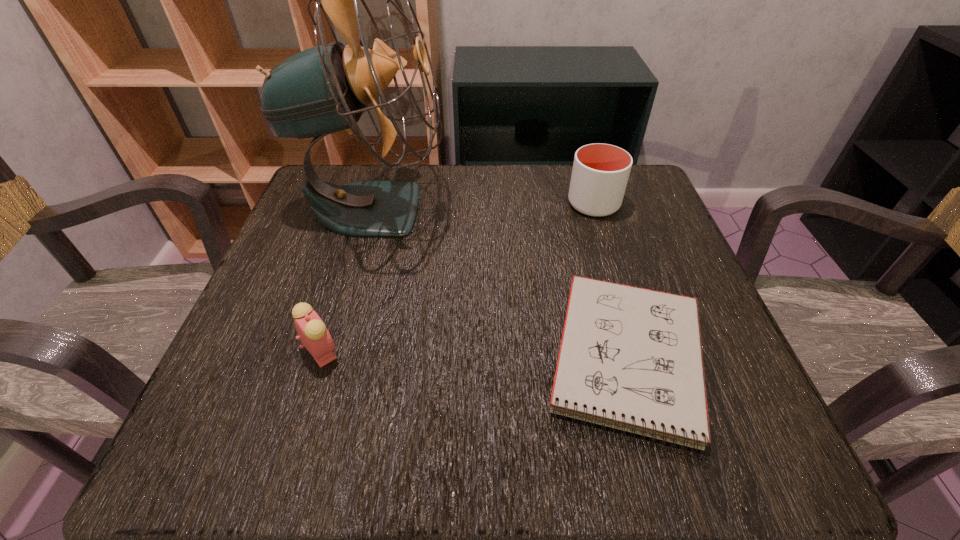
You are a GUI agent. You are given a task and a screenshot of the screen. Output one action in this format:
    pyautogui.click(x=<x>, y=<y>)
    Task: Click on the free space at the left edge of the desktop
    This screenshot has height=540, width=960.
    Given the screenshot: What is the action you would take?
    pyautogui.click(x=245, y=369)

Where is `vacant space at the right edge of the desktop`? vacant space at the right edge of the desktop is located at coordinates (642, 262).

What are the coordinates of `free space at the far left corner of the desktop` in the screenshot? It's located at (375, 174).

This screenshot has height=540, width=960. What are the coordinates of `vacant space at the near left corner of the desktop` in the screenshot? It's located at (242, 444).

In the image, there is a desktop. Where is `free region at the far right corner`? This screenshot has height=540, width=960. free region at the far right corner is located at coordinates (642, 217).

Identify the location of free area in between the fan and the alarm clock. This screenshot has height=540, width=960. (348, 280).

Identify the location of vacant space that's between the notepad and the fan. Image resolution: width=960 pixels, height=540 pixels. (501, 284).

Identify the location of free area in between the alarm clock and the fan. The width and height of the screenshot is (960, 540). (348, 280).

Locate an element on the screen. free space between the cup and the alarm clock is located at coordinates (458, 278).

The height and width of the screenshot is (540, 960). What are the coordinates of `free point between the fan and the second tallest object` in the screenshot? It's located at point(484,206).